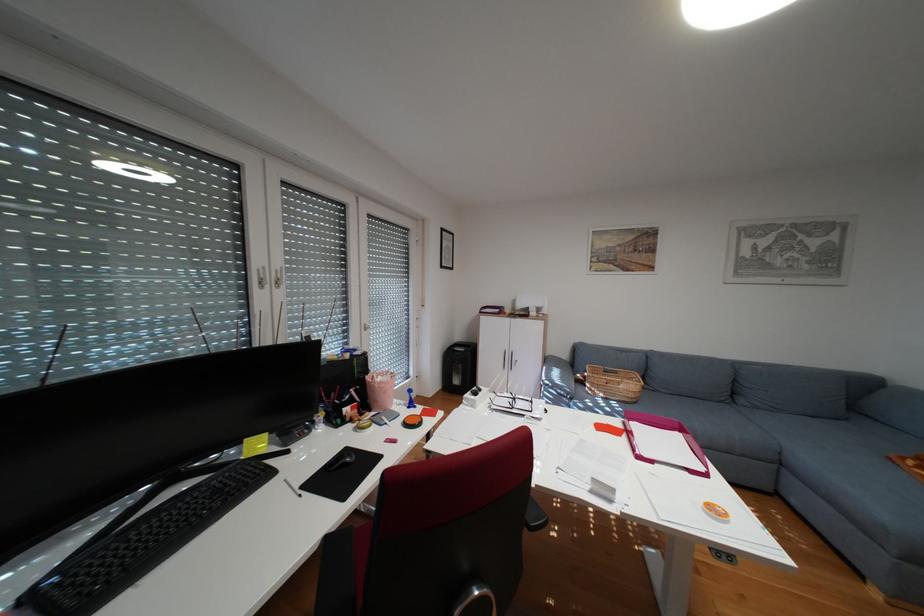
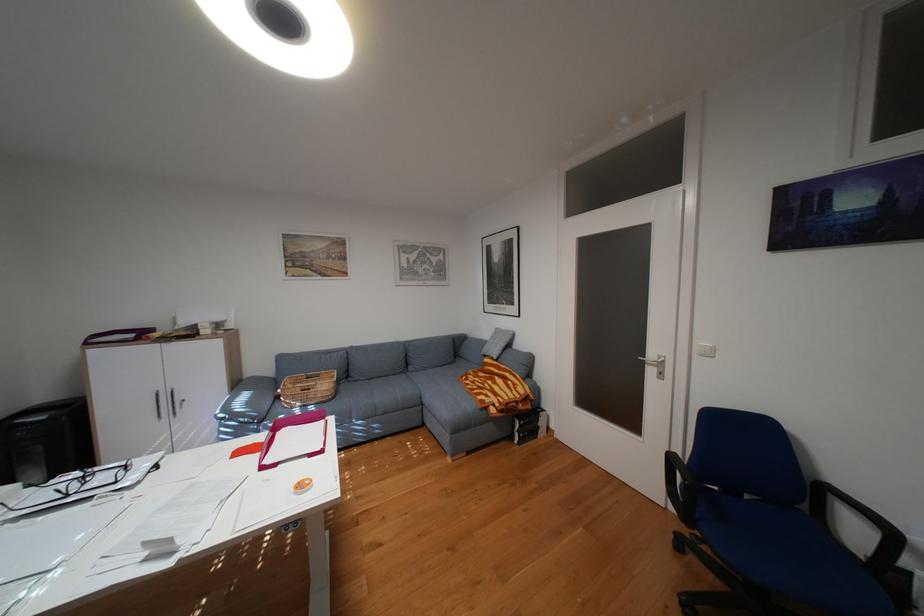
The point at (655, 453) is marked in the first image. Where is the corresponding point in the second image?

(280, 460)